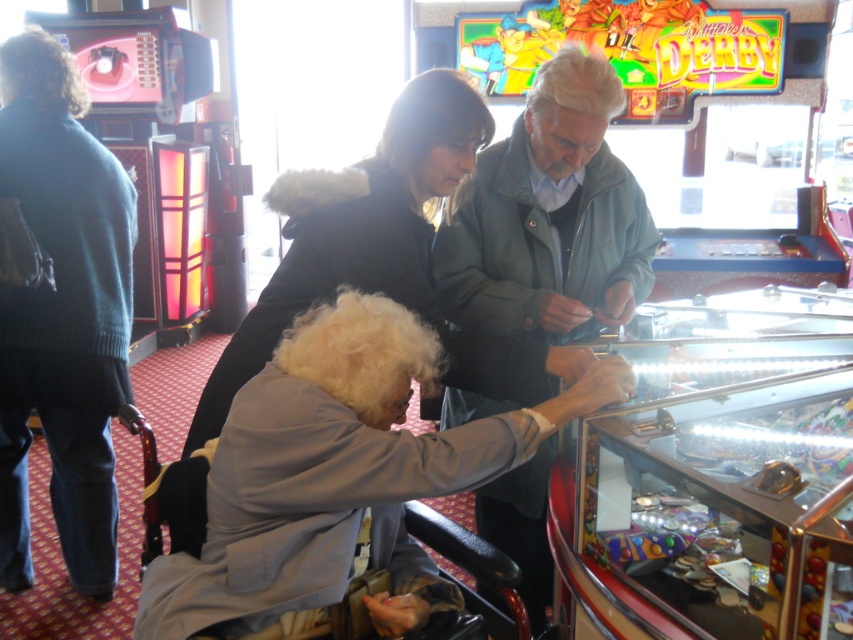
Does gray fabric jacket at center have a larger size compared to gray-green leather jacket at center?

No, gray fabric jacket at center is not bigger than gray-green leather jacket at center.

Between point (364, 346) and point (582, 154), which one is positioned in front?

Point (364, 346) is in front.

I want to click on gray fabric jacket at center, so click(x=329, y=476).

Measure the distance from gray fabric jacket at center to dark blue sweater at left.

gray fabric jacket at center and dark blue sweater at left are 1.30 meters apart.

Does point (250, 481) come behind point (13, 464)?

No, (250, 481) is in front of (13, 464).

You are a GUI agent. You are given a task and a screenshot of the screen. Output one action in this format:
    pyautogui.click(x=<x>, y=<y>)
    Task: Click on the gray fabric jacket at center
    The width and height of the screenshot is (853, 640).
    Given the screenshot: What is the action you would take?
    point(329,476)

Which is more to the left, dark blue sweater at left or gray-green leather jacket at center?

dark blue sweater at left

Between point (26, 225) and point (558, 120), which one is positioned in front?

Point (558, 120)

Which is in front, point (57, 129) or point (554, 257)?

Point (554, 257) is more forward.

Where is `dark blue sweater at left`? Image resolution: width=853 pixels, height=640 pixels. dark blue sweater at left is located at coordinates (61, 310).